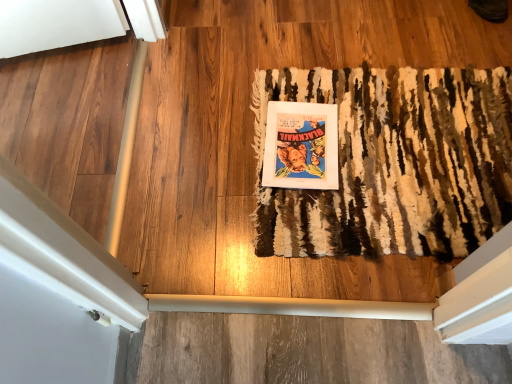
Question: In the image, is rug at center on the left side or the right side of matte paper poster at center?

Choices:
 (A) right
 (B) left

Answer: (A)

Question: From the image's perspective, is rug at center located above or below matte paper poster at center?

Choices:
 (A) above
 (B) below

Answer: (B)

Question: Is point (403, 117) closer or farther from the camera than point (335, 150)?

Choices:
 (A) closer
 (B) farther

Answer: (B)

Question: Do you think matte paper poster at center is within rug at center, or outside of it?

Choices:
 (A) inside
 (B) outside

Answer: (A)

Question: Is matte paper poster at center wider or thinner than rug at center?

Choices:
 (A) thin
 (B) wide

Answer: (A)

Question: Considering their positions, is matte paper poster at center located in front of or behind rug at center?

Choices:
 (A) front
 (B) behind

Answer: (B)

Question: Considering the positions of point (306, 119) and point (290, 213), is point (306, 119) closer or farther from the camera than point (290, 213)?

Choices:
 (A) farther
 (B) closer

Answer: (A)